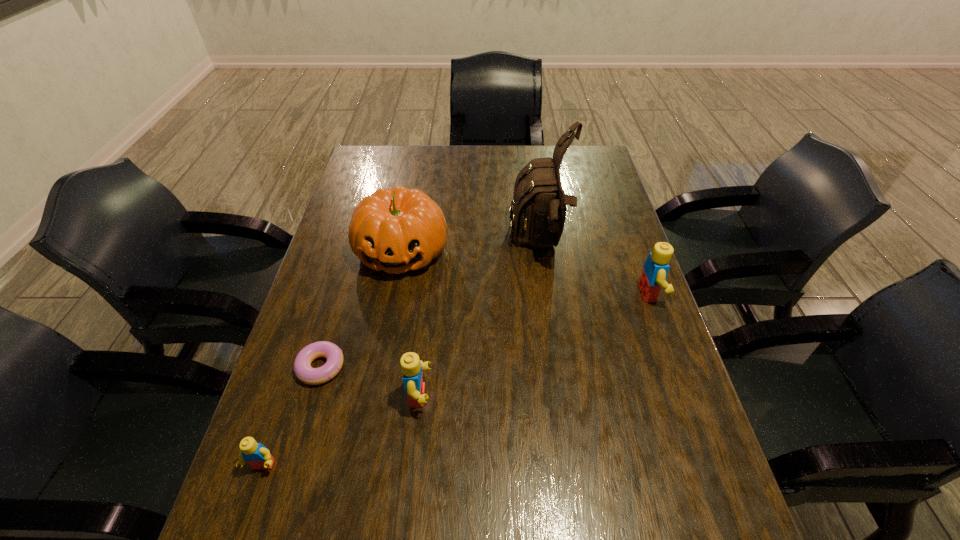
This screenshot has width=960, height=540. Find the location of `unoccupied area between the pumpkin and the shoulder bag`. unoccupied area between the pumpkin and the shoulder bag is located at coordinates (471, 247).

Identify the location of free space between the third shortest object and the second object from right to left. (480, 320).

You are a GUI agent. You are given a task and a screenshot of the screen. Output one action in this format:
    pyautogui.click(x=<x>, y=<y>)
    Task: Click on the free space between the farthest Lego and the pumpkin
    This screenshot has width=960, height=540.
    Given the screenshot: What is the action you would take?
    pyautogui.click(x=526, y=272)

You are a GUI agent. You are given a task and a screenshot of the screen. Output one action in this format:
    pyautogui.click(x=<x>, y=<y>)
    Task: Click on the vacant area that lies between the pumpkin and the second nearest Lego
    
    Given the screenshot: What is the action you would take?
    pyautogui.click(x=411, y=323)

At what (x,y) coordinates should I click in order to perform the action: click on object that stands as the second closest to the doughnut. Please return your answer as a coordinate pair (x, y). Looking at the image, I should click on (411, 366).

Locate which object is the fourth closest to the pumpkin. Please provide its 2D coordinates. Your answer should be formatted as a tuple, i.e. [(x, y)], where the tuple contains the x and y coordinates of a point satisfying the conditions above.

[(257, 455)]

Identify the location of Lego that is the second closest to the shoulder bag. (411, 366).

Locate an element on the screen. The height and width of the screenshot is (540, 960). Lego identified as the closest to the fourth tallest object is located at coordinates (257, 455).

Identify the location of free region that satisfies the following two spatial constraints: 1. on the front-facing side of the farthest Lego; 2. on the front-facing side of the second shortest object. This screenshot has height=540, width=960. (711, 466).

Identify the location of free region that satisfies the following two spatial constraints: 1. on the front-facing side of the shoulder bag; 2. on the front-facing side of the nearest object. (571, 466).